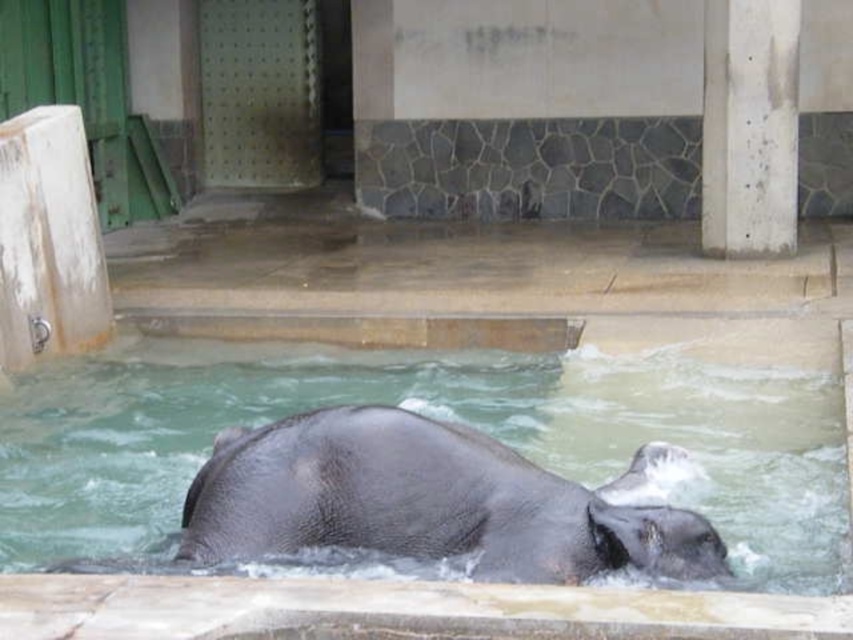
Measure the distance from gray textured elephant at center to white concrete pillar at upper right.

7.01 meters

Does gray textured elephant at center have a smaller size compared to white concrete pillar at upper right?

Yes.

Is point (386, 417) farther from viewer compared to point (781, 244)?

No, (386, 417) is in front of (781, 244).

Find the location of `gray textured elephant at center`. gray textured elephant at center is located at coordinates (424, 502).

Is gray matte water at center above gray textured elephant at center?

No, gray matte water at center is not above gray textured elephant at center.

Is gray matte water at center to the left of gray textured elephant at center from the viewer's perspective?

Yes, gray matte water at center is to the left of gray textured elephant at center.

Which is behind, point (79, 554) or point (428, 426)?

The point (79, 554) is behind.

Identify the location of gray matte water at center. (432, 417).

Who is lower down, gray matte water at center or white concrete pillar at upper right?

gray matte water at center

Does gray matte water at center come in front of white concrete pillar at upper right?

That is True.

Which is behind, point (473, 356) or point (775, 128)?

The point (775, 128) is behind.

Image resolution: width=853 pixels, height=640 pixels. I want to click on gray matte water at center, so click(x=432, y=417).